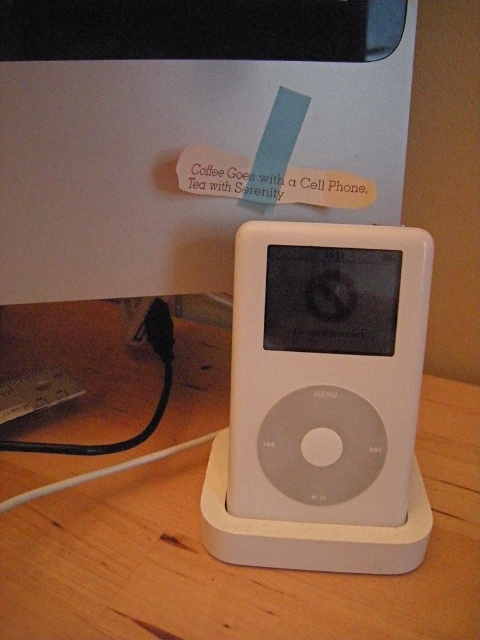
Question: Is wooden table at center further to camera compared to white matte/ipod at center?

Choices:
 (A) no
 (B) yes

Answer: (A)

Question: Does wooden table at center have a lesser width compared to white matte/ipod at center?

Choices:
 (A) yes
 (B) no

Answer: (B)

Question: Where is wooden table at center located in relation to white matte/ipod at center in the image?

Choices:
 (A) left
 (B) right

Answer: (A)

Question: Which point is farther from the camera taking this photo?

Choices:
 (A) (200, 426)
 (B) (420, 324)

Answer: (A)